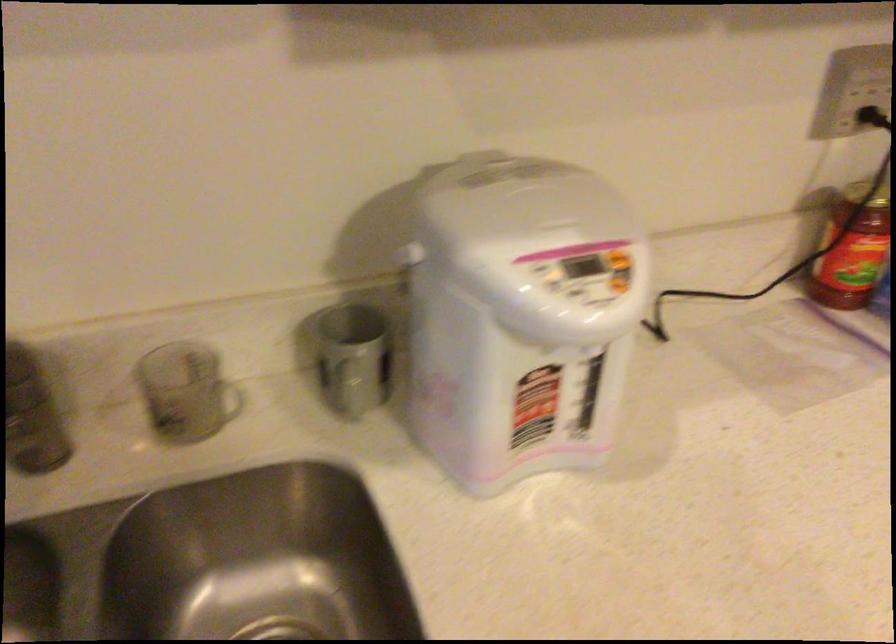
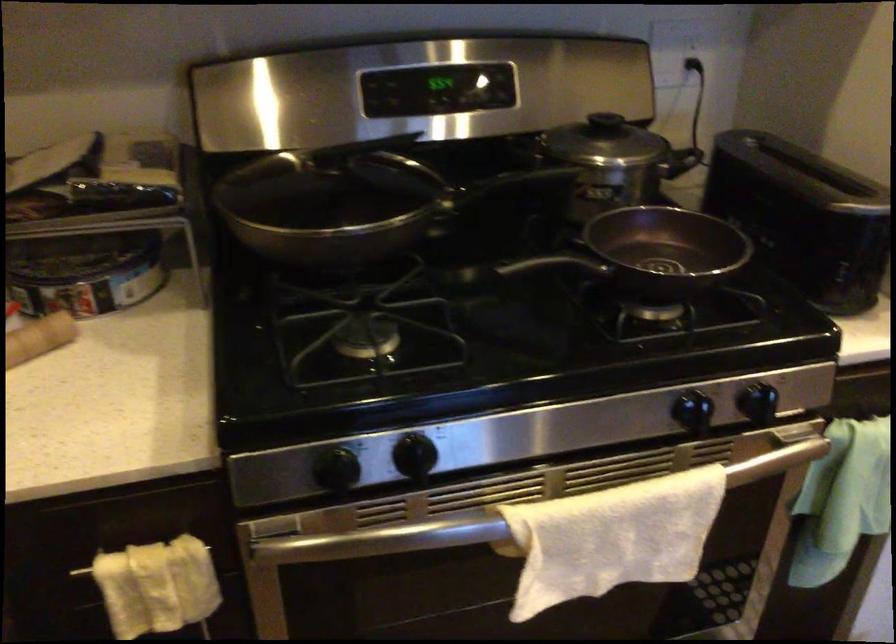
First-person continuous shooting, in which direction is the camera rotating?

The camera rotated toward right-down.